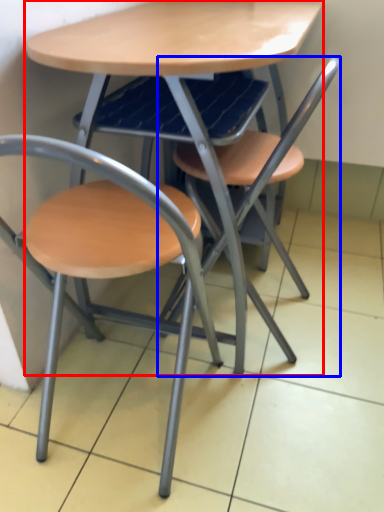
Question: Which of the following is the farthest to the observer, table (highlighted by a red box) or chair (highlighted by a blue box)?

Choices:
 (A) table
 (B) chair

Answer: (B)